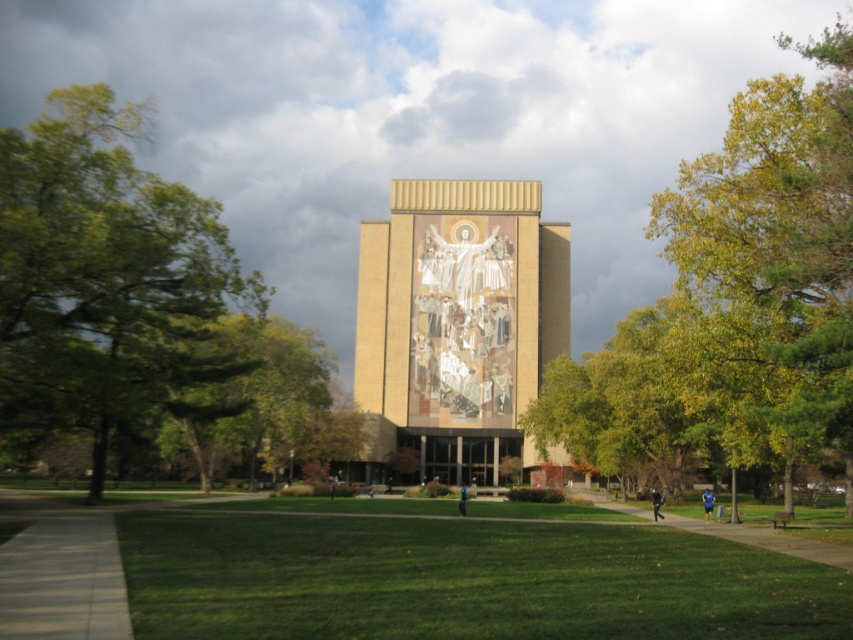
Looking at this image, can you confirm if yellow-green leafy tree at right is thinner than green leafy tree at center?

Incorrect, yellow-green leafy tree at right's width is not less than green leafy tree at center's.

Who is taller, yellow-green leafy tree at right or green leafy tree at center?

yellow-green leafy tree at right

Between point (675, 224) and point (245, 376), which one is positioned in front?

Point (675, 224)

Where is `yellow-green leafy tree at right`? yellow-green leafy tree at right is located at coordinates (735, 300).

Can you confirm if green grass at center is positioned to the left of green leafy tree at left?

Incorrect, green grass at center is not on the left side of green leafy tree at left.

Is point (438, 570) more distant than point (166, 310)?

No, (438, 570) is in front of (166, 310).

Where is `green grass at center`? The image size is (853, 640). green grass at center is located at coordinates (463, 580).

Does green leafy tree at left come in front of green leafy tree at center?

Yes, green leafy tree at left is closer to the viewer.

Where is `green leafy tree at left`? This screenshot has height=640, width=853. green leafy tree at left is located at coordinates (105, 278).